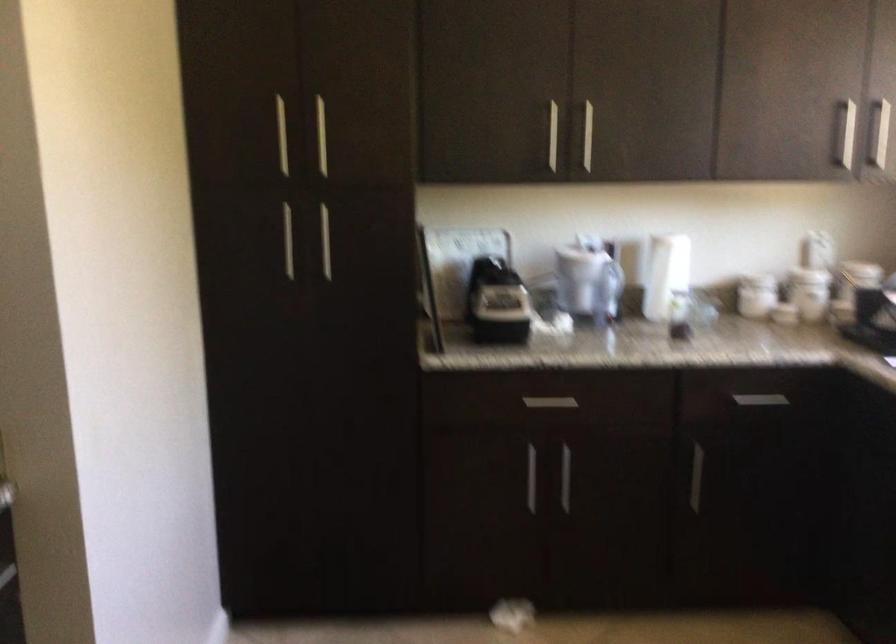
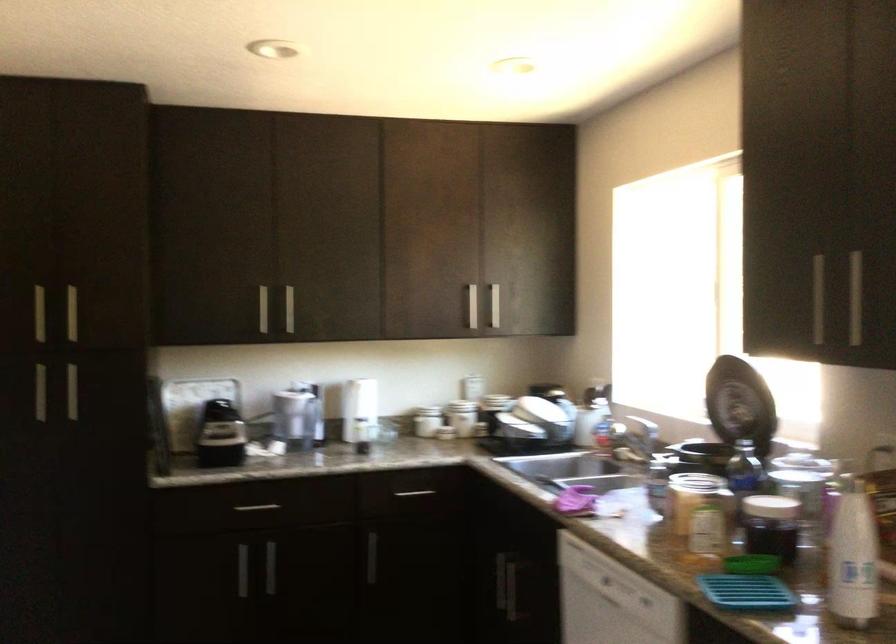
Where in the second image is the point corresponding to the point at 756,395 from the first image?

(414, 493)